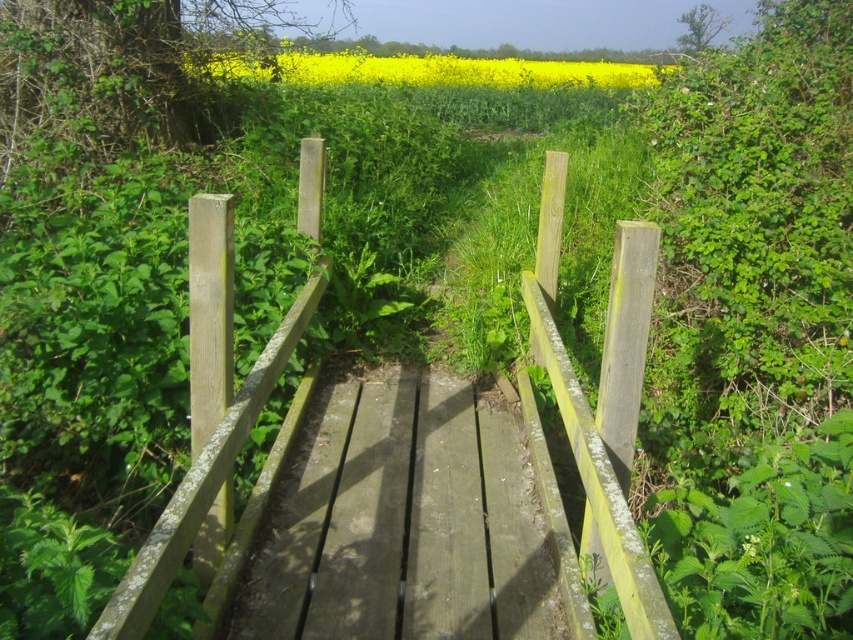
Question: Can you confirm if smooth wooden path at center is positioned below yellow matte field at upper center?

Choices:
 (A) yes
 (B) no

Answer: (A)

Question: In this image, where is smooth wooden path at center located relative to yellow matte field at upper center?

Choices:
 (A) right
 (B) left

Answer: (A)

Question: Which point is closer to the camera?

Choices:
 (A) (x=514, y=568)
 (B) (x=457, y=83)

Answer: (A)

Question: Which object appears closest to the camera in this image?

Choices:
 (A) yellow matte field at upper center
 (B) smooth wooden path at center

Answer: (B)

Question: Which object appears closest to the camera in this image?

Choices:
 (A) yellow matte field at upper center
 (B) smooth wooden path at center

Answer: (B)

Question: Observing the image, what is the correct spatial positioning of weathered wood rail at center in reference to yellow matte field at upper center?

Choices:
 (A) below
 (B) above

Answer: (A)